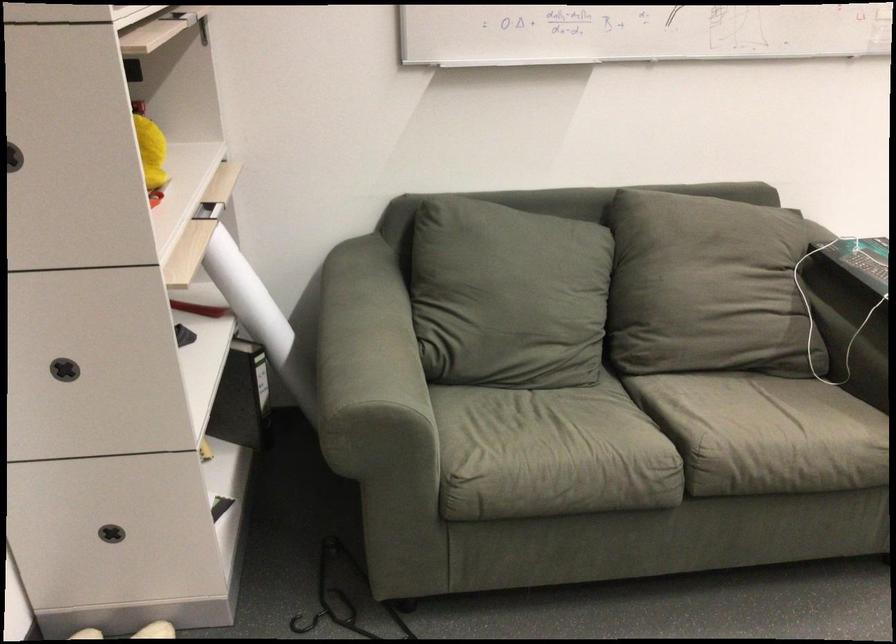
In order to click on laptop computer in this screenshot , I will do `click(860, 259)`.